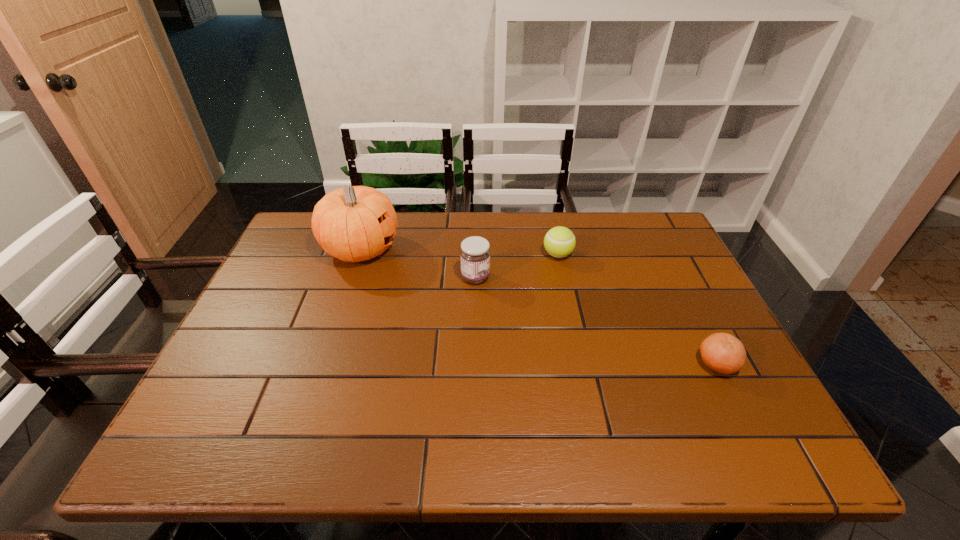
The height and width of the screenshot is (540, 960). In the image, there is a desktop. Identify the location of free space at the far left corner. (310, 215).

Locate an element on the screen. The height and width of the screenshot is (540, 960). free space between the second shortest object and the pumpkin is located at coordinates (459, 252).

This screenshot has width=960, height=540. Identify the location of unoccupied position between the tallest object and the nearest object. (539, 307).

You are a GUI agent. You are given a task and a screenshot of the screen. Output one action in this format:
    pyautogui.click(x=<x>, y=<y>)
    Task: Click on the free space between the tallest object and the second object from right to left
    
    Given the screenshot: What is the action you would take?
    pyautogui.click(x=459, y=252)

Locate an element on the screen. Image resolution: width=960 pixels, height=540 pixels. vacant space that is in between the leftmost object and the jam is located at coordinates (x=418, y=263).

You are a GUI agent. You are given a task and a screenshot of the screen. Output one action in this format:
    pyautogui.click(x=<x>, y=<y>)
    Task: Click on the vacant area that lies between the leftmost object and the second object from left to right
    
    Given the screenshot: What is the action you would take?
    pyautogui.click(x=418, y=263)

At what (x,y) coordinates should I click in order to perform the action: click on free spot between the pumpkin and the nearest object. Please return your answer as a coordinate pair (x, y). The width and height of the screenshot is (960, 540). Looking at the image, I should click on (539, 307).

This screenshot has height=540, width=960. Find the location of `free space between the jam and the pumpkin`. free space between the jam and the pumpkin is located at coordinates (418, 263).

This screenshot has height=540, width=960. Identify the location of free space between the third shortest object and the tennis ball. (516, 266).

This screenshot has height=540, width=960. Find the location of `free spot between the pumpkin and the rightmost object`. free spot between the pumpkin and the rightmost object is located at coordinates (539, 307).